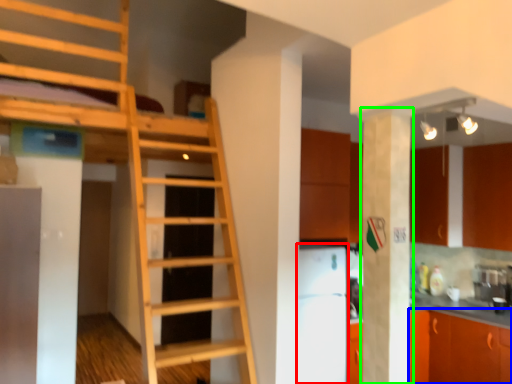
Question: Which object is positioned closest to appliance (highlighted by a red box)? Select from cabinetry (highlighted by a blue box) and pillar (highlighted by a green box).

Choices:
 (A) cabinetry
 (B) pillar

Answer: (A)